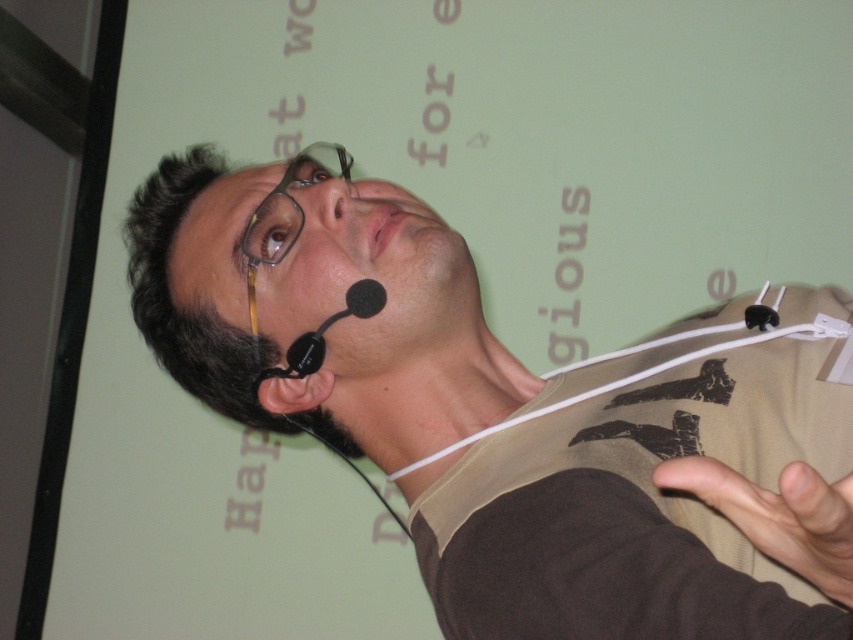
You are designing a backdrop for a presentation and need to ensure that the matte black shirt at center will not be obscured by the brown fabric hand at lower right. Based on their sizes, which object is wider?

The matte black shirt at center might be wider than brown fabric hand at lower right, so the shirt is likely wider and less likely to be obscured by the hand.

You are designing a poster for an event and need to include both the matte black shirt at center and the brown fabric hand at lower right. Which object should you make larger to maintain the original scene proportions?

The matte black shirt at center should be made larger than the brown fabric hand at lower right to maintain the original scene proportions since it is bigger in the scene.